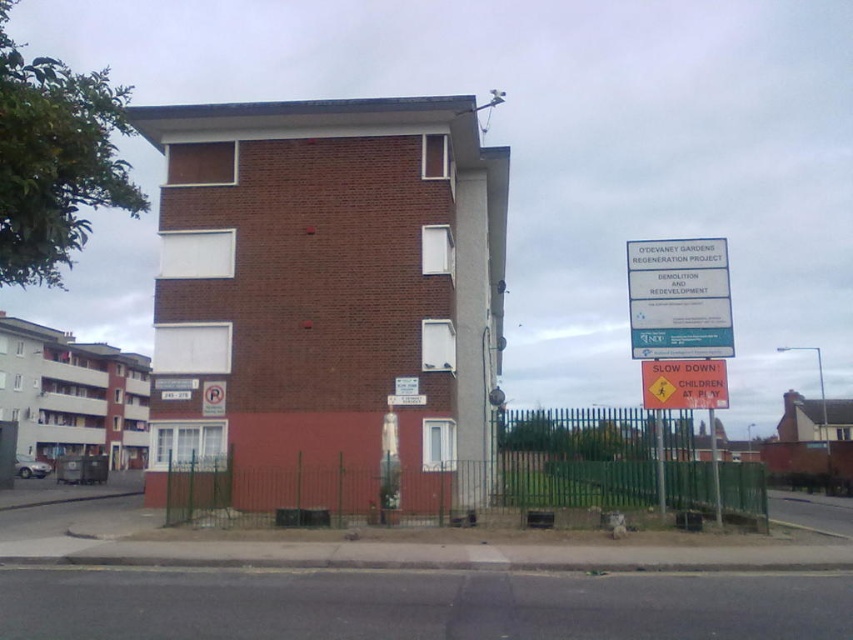
Between green metal fence at center and orange plastic sign at right, which one is positioned higher?

orange plastic sign at right

Which of these two, green metal fence at center or orange plastic sign at right, stands shorter?

orange plastic sign at right

This screenshot has width=853, height=640. What do you see at coordinates (467, 493) in the screenshot?
I see `green metal fence at center` at bounding box center [467, 493].

The width and height of the screenshot is (853, 640). Identify the location of green metal fence at center. (467, 493).